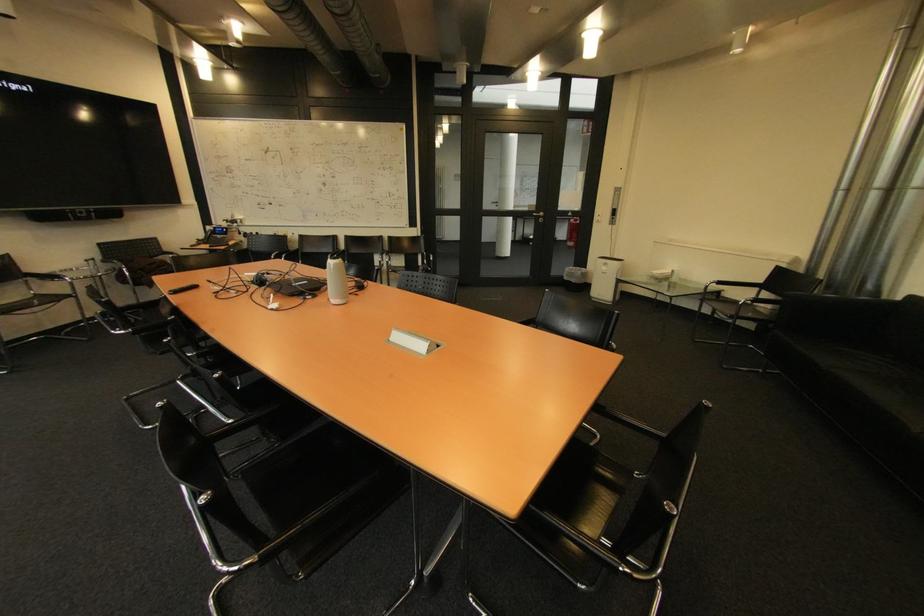
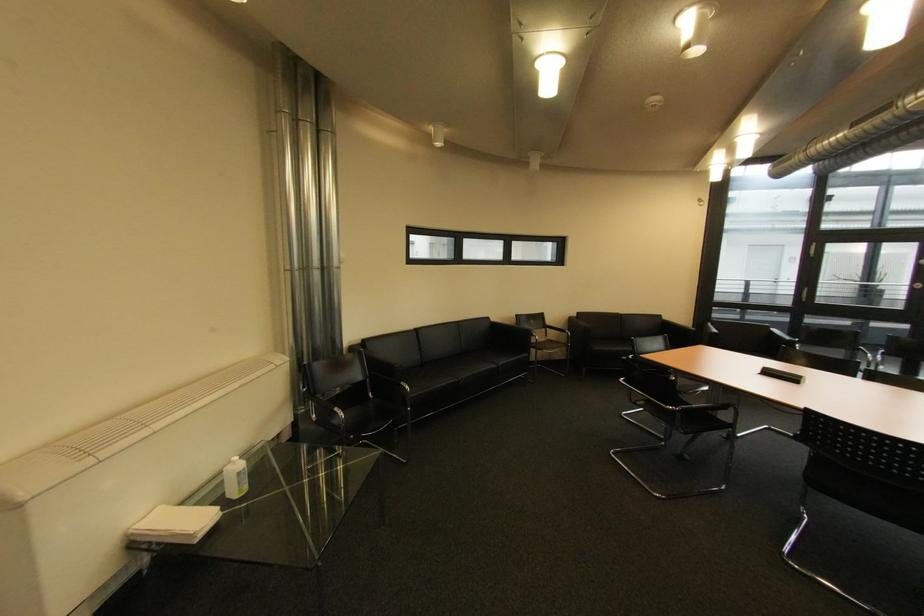
Question: I am providing you with two images of the same scene from different viewpoints. Which of the following objects are not visible in image2?

Choices:
 (A) chair sitting surface
 (B) white bottle
 (C) chrome chair armrest
 (D) purple printer lid

Answer: (C)